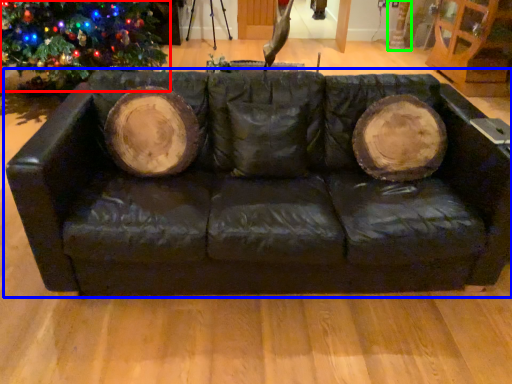
Question: Which object is the closest to the christmas tree (highlighted by a red box)? Choose among these: studio couch (highlighted by a blue box) or tree trunk (highlighted by a green box).

Choices:
 (A) studio couch
 (B) tree trunk

Answer: (A)